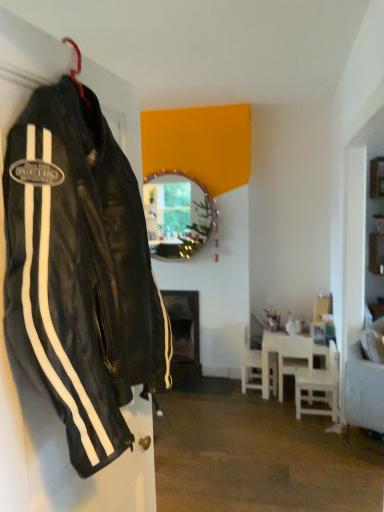
Locate an element on the screen. The width and height of the screenshot is (384, 512). unoccupied area in front of white plastic chair at lower right, arranged as the third chair when viewed from the back is located at coordinates (309, 426).